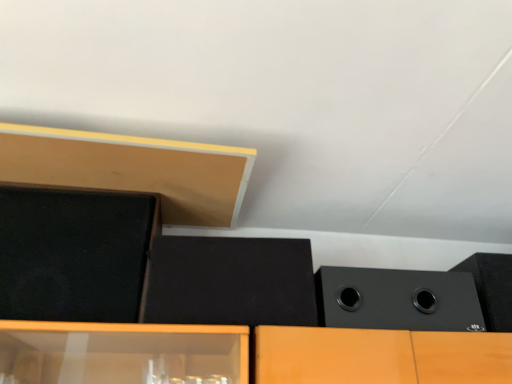
Locate an element on the screen. This screenshot has height=384, width=512. matte wood at upper left is located at coordinates (133, 169).

The image size is (512, 384). In order to click on black matte speaker at upper right, the first speaker when ordered from right to left in this screenshot , I will do `click(492, 287)`.

In order to click on matte wood at upper left in this screenshot , I will do `click(133, 169)`.

Considering the relative positions of matte wood at upper left and matte black speaker at upper left, positioned as the first speaker in left-to-right order, in the image provided, is matte wood at upper left to the left of matte black speaker at upper left, positioned as the first speaker in left-to-right order, from the viewer's perspective?

Incorrect, matte wood at upper left is not on the left side of matte black speaker at upper left, positioned as the first speaker in left-to-right order.

Consider the image. Is matte wood at upper left in contact with matte black speaker at upper left, which is counted as the fourth speaker, starting from the right?

No, matte wood at upper left is not next to matte black speaker at upper left, which is counted as the fourth speaker, starting from the right.

What's the angular difference between matte wood at upper left and matte black speaker at upper left, which is counted as the fourth speaker, starting from the right,'s facing directions?

0.000487 degrees.

Can you confirm if matte wood at upper left is thinner than matte black speaker at upper left, which is counted as the fourth speaker, starting from the right?

No, matte wood at upper left is not thinner than matte black speaker at upper left, which is counted as the fourth speaker, starting from the right.

Looking at their sizes, would you say black matte speaker at center, which appears as the third speaker when viewed from the right, is wider or thinner than matte black speaker at upper left, which is counted as the fourth speaker, starting from the right?

Considering their sizes, black matte speaker at center, which appears as the third speaker when viewed from the right, looks broader than matte black speaker at upper left, which is counted as the fourth speaker, starting from the right.

Which speaker is the 1st one when counting from the back of the matte black speaker at upper left, positioned as the first speaker in left-to-right order? Please provide its 2D coordinates.

[(230, 281)]

Is black matte speaker at center, the second speaker from the left, next to matte black speaker at upper left, positioned as the first speaker in left-to-right order, and touching it?

No, black matte speaker at center, the second speaker from the left, is not with matte black speaker at upper left, positioned as the first speaker in left-to-right order.

Is black matte speaker at center, the second speaker from the left, aimed at matte black speaker at upper left, which is counted as the fourth speaker, starting from the right?

No, black matte speaker at center, the second speaker from the left, does not turn towards matte black speaker at upper left, which is counted as the fourth speaker, starting from the right.

From the image's perspective, is black matte speaker at upper right, which is counted as the fourth speaker, starting from the left, over matte black speaker at upper left, positioned as the first speaker in left-to-right order?

No, from the image's perspective, black matte speaker at upper right, which is counted as the fourth speaker, starting from the left, is not on top of matte black speaker at upper left, positioned as the first speaker in left-to-right order.

From a real-world perspective, which object stands above the other?

matte black speaker at upper left, positioned as the first speaker in left-to-right order, from a real-world perspective.

Is black matte speaker at upper right, which is counted as the fourth speaker, starting from the left, taller than matte black speaker at upper left, which is counted as the fourth speaker, starting from the right?

Incorrect, the height of black matte speaker at upper right, which is counted as the fourth speaker, starting from the left, is not larger of that of matte black speaker at upper left, which is counted as the fourth speaker, starting from the right.

Considering the relative sizes of matte wood at upper left and black matte speaker at right, which is the 3th speaker in left-to-right order, in the image provided, is matte wood at upper left taller than black matte speaker at right, which is the 3th speaker in left-to-right order,?

Incorrect, the height of matte wood at upper left is not larger of that of black matte speaker at right, which is the 3th speaker in left-to-right order.

Consider the image. Would you say matte wood at upper left is to the left or to the right of black matte speaker at right, arranged as the second speaker when viewed from the right, in the picture?

Clearly, matte wood at upper left is on the left of black matte speaker at right, arranged as the second speaker when viewed from the right, in the image.

In the scene shown: From a real-world perspective, who is located lower, matte wood at upper left or black matte speaker at right, which is the 3th speaker in left-to-right order?

From a 3D spatial view, black matte speaker at right, which is the 3th speaker in left-to-right order, is below.

Considering the sizes of objects black matte speaker at right, arranged as the second speaker when viewed from the right, and black matte speaker at center, which appears as the third speaker when viewed from the right, in the image provided, who is taller, black matte speaker at right, arranged as the second speaker when viewed from the right, or black matte speaker at center, which appears as the third speaker when viewed from the right,?

black matte speaker at center, which appears as the third speaker when viewed from the right.

Which of these two, black matte speaker at right, which is the 3th speaker in left-to-right order, or black matte speaker at center, which appears as the third speaker when viewed from the right, is thinner?

With smaller width is black matte speaker at center, which appears as the third speaker when viewed from the right.

How different are the orientations of black matte speaker at right, arranged as the second speaker when viewed from the right, and black matte speaker at center, the second speaker from the left, in degrees?

0.00335 degrees separate the facing orientations of black matte speaker at right, arranged as the second speaker when viewed from the right, and black matte speaker at center, the second speaker from the left.

The height and width of the screenshot is (384, 512). Find the location of `speaker behind the black matte speaker at right, arranged as the second speaker when viewed from the right`. speaker behind the black matte speaker at right, arranged as the second speaker when viewed from the right is located at coordinates (492, 287).

Is black matte speaker at right, which is the 3th speaker in left-to-right order, positioned beyond the bounds of black matte speaker at upper right, the first speaker when ordered from right to left?

That's correct, black matte speaker at right, which is the 3th speaker in left-to-right order, is outside of black matte speaker at upper right, the first speaker when ordered from right to left.

From a real-world perspective, relative to black matte speaker at upper right, the first speaker when ordered from right to left, is black matte speaker at right, arranged as the second speaker when viewed from the right, vertically above or below?

From a real-world perspective, black matte speaker at right, arranged as the second speaker when viewed from the right, is physically below black matte speaker at upper right, the first speaker when ordered from right to left.

Is black matte speaker at right, which is the 3th speaker in left-to-right order, wider or thinner than black matte speaker at upper right, which is counted as the fourth speaker, starting from the left?

Clearly, black matte speaker at right, which is the 3th speaker in left-to-right order, has less width compared to black matte speaker at upper right, which is counted as the fourth speaker, starting from the left.

Does point (224, 324) lie in front of point (190, 201)?

Yes, it is in front of point (190, 201).

Is the surface of black matte speaker at center, which appears as the third speaker when viewed from the right, in direct contact with matte wood at upper left?

No, black matte speaker at center, which appears as the third speaker when viewed from the right, is not touching matte wood at upper left.

Considering the relative positions of black matte speaker at center, the second speaker from the left, and matte wood at upper left in the image provided, is black matte speaker at center, the second speaker from the left, to the left of matte wood at upper left from the viewer's perspective?

Incorrect, black matte speaker at center, the second speaker from the left, is not on the left side of matte wood at upper left.

Locate an element on the screen. The height and width of the screenshot is (384, 512). wood that appears above the matte black speaker at upper left, positioned as the first speaker in left-to-right order (from the image's perspective) is located at coordinates (133, 169).

You are a GUI agent. You are given a task and a screenshot of the screen. Output one action in this format:
    pyautogui.click(x=<x>, y=<y>)
    Task: Click on the 1st speaker counting from the right side of the matte black speaker at upper left, positioned as the first speaker in left-to-right order
    This screenshot has width=512, height=384.
    Given the screenshot: What is the action you would take?
    pyautogui.click(x=230, y=281)

When comparing their distances from black matte speaker at center, the second speaker from the left, does black matte speaker at upper right, which is counted as the fourth speaker, starting from the left, or matte wood at upper left seem further?

black matte speaker at upper right, which is counted as the fourth speaker, starting from the left, lies further to black matte speaker at center, the second speaker from the left, than the other object.

Which object lies nearer to the anchor point black matte speaker at center, which appears as the third speaker when viewed from the right, matte black speaker at upper left, which is counted as the fourth speaker, starting from the right, or black matte speaker at upper right, the first speaker when ordered from right to left?

Among the two, matte black speaker at upper left, which is counted as the fourth speaker, starting from the right, is located nearer to black matte speaker at center, which appears as the third speaker when viewed from the right.

From the image, which object appears to be nearer to black matte speaker at right, arranged as the second speaker when viewed from the right, black matte speaker at center, which appears as the third speaker when viewed from the right, or matte wood at upper left?

Based on the image, black matte speaker at center, which appears as the third speaker when viewed from the right, appears to be nearer to black matte speaker at right, arranged as the second speaker when viewed from the right.

Estimate the real-world distances between objects in this image. Which object is closer to black matte speaker at center, the second speaker from the left, matte black speaker at upper left, which is counted as the fourth speaker, starting from the right, or black matte speaker at right, arranged as the second speaker when viewed from the right?

Among the two, black matte speaker at right, arranged as the second speaker when viewed from the right, is located nearer to black matte speaker at center, the second speaker from the left.

From the image, which object appears to be nearer to matte wood at upper left, black matte speaker at center, which appears as the third speaker when viewed from the right, or black matte speaker at right, arranged as the second speaker when viewed from the right?

black matte speaker at center, which appears as the third speaker when viewed from the right, is closer to matte wood at upper left.

Based on their spatial positions, is black matte speaker at right, which is the 3th speaker in left-to-right order, or matte black speaker at upper left, positioned as the first speaker in left-to-right order, closer to black matte speaker at center, the second speaker from the left?

black matte speaker at right, which is the 3th speaker in left-to-right order, is positioned closer to the anchor black matte speaker at center, the second speaker from the left.

Based on their spatial positions, is matte wood at upper left or matte black speaker at upper left, positioned as the first speaker in left-to-right order, closer to black matte speaker at center, the second speaker from the left?

matte black speaker at upper left, positioned as the first speaker in left-to-right order, lies closer to black matte speaker at center, the second speaker from the left, than the other object.

From the image, which object appears to be nearer to black matte speaker at upper right, which is counted as the fourth speaker, starting from the left, matte black speaker at upper left, which is counted as the fourth speaker, starting from the right, or black matte speaker at center, which appears as the third speaker when viewed from the right?

black matte speaker at center, which appears as the third speaker when viewed from the right, is closer to black matte speaker at upper right, which is counted as the fourth speaker, starting from the left.

This screenshot has width=512, height=384. What are the coordinates of `wood between matte black speaker at upper left, which is counted as the fourth speaker, starting from the right, and black matte speaker at right, which is the 3th speaker in left-to-right order, in the horizontal direction` in the screenshot? It's located at (133, 169).

At what (x,y) coordinates should I click in order to perform the action: click on speaker between matte black speaker at upper left, positioned as the first speaker in left-to-right order, and black matte speaker at right, which is the 3th speaker in left-to-right order, in the horizontal direction. Please return your answer as a coordinate pair (x, y). Looking at the image, I should click on (230, 281).

Image resolution: width=512 pixels, height=384 pixels. Identify the location of speaker located between matte wood at upper left and black matte speaker at right, which is the 3th speaker in left-to-right order, in the left-right direction. tap(230, 281).

You are a GUI agent. You are given a task and a screenshot of the screen. Output one action in this format:
    pyautogui.click(x=<x>, y=<y>)
    Task: Click on the wood located between matte black speaker at upper left, which is counted as the fourth speaker, starting from the right, and black matte speaker at upper right, the first speaker when ordered from right to left, in the left-right direction
    
    Given the screenshot: What is the action you would take?
    pyautogui.click(x=133, y=169)